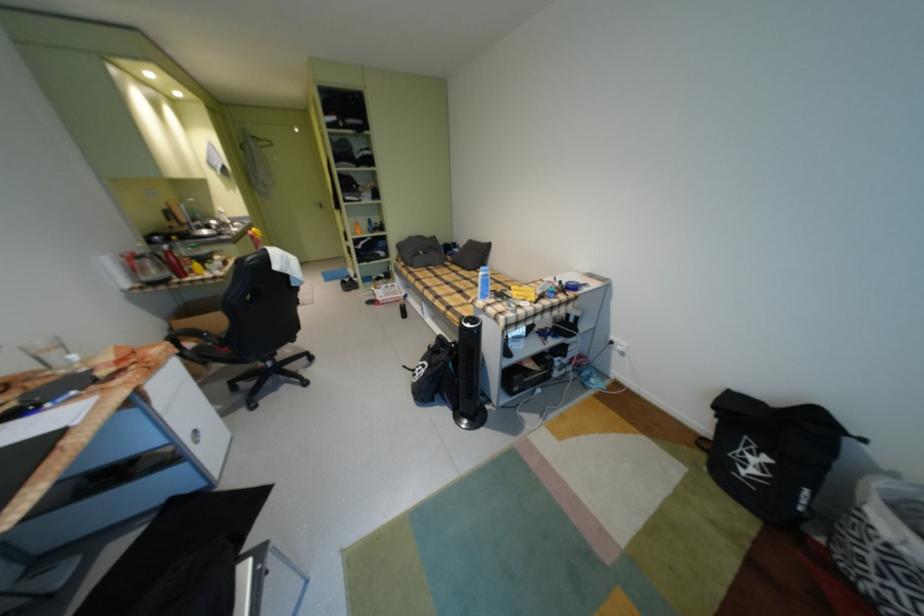
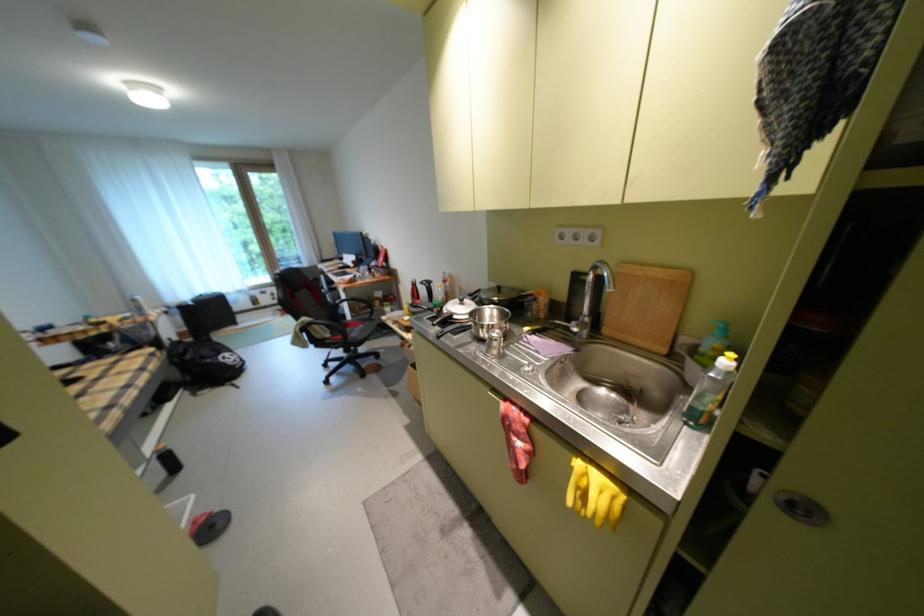
In the second image, find the point that corresponds to [431,374] in the first image.

(239, 358)